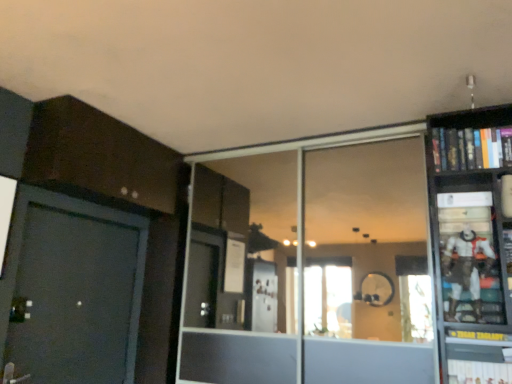
Question: From a real-world perspective, is hardcover book at lower right, the 2th book when ordered from top to bottom, located higher than white matte action figure at right?

Choices:
 (A) no
 (B) yes

Answer: (A)

Question: From the image's perspective, is hardcover book at lower right, positioned as the 1th book in bottom-to-top order, located above white matte action figure at right?

Choices:
 (A) yes
 (B) no

Answer: (B)

Question: From the image's perspective, would you say hardcover book at lower right, the 2th book when ordered from top to bottom, is shown under white matte action figure at right?

Choices:
 (A) yes
 (B) no

Answer: (A)

Question: Is hardcover book at lower right, the 2th book when ordered from top to bottom, facing towards white matte action figure at right?

Choices:
 (A) yes
 (B) no

Answer: (B)

Question: From a real-world perspective, is hardcover book at lower right, the 2th book when ordered from top to bottom, below white matte action figure at right?

Choices:
 (A) yes
 (B) no

Answer: (A)

Question: Is hardcover book at lower right, the 2th book when ordered from top to bottom, to the left or to the right of hardcover book at upper right, which is counted as the 2th book, starting from the bottom, in the image?

Choices:
 (A) left
 (B) right

Answer: (A)

Question: From the image's perspective, is hardcover book at lower right, the 2th book when ordered from top to bottom, located above or below hardcover book at upper right, which is the 1th book in top-to-bottom order?

Choices:
 (A) below
 (B) above

Answer: (A)

Question: Looking at their shapes, would you say hardcover book at lower right, positioned as the 1th book in bottom-to-top order, is wider or thinner than hardcover book at upper right, which is counted as the 2th book, starting from the bottom?

Choices:
 (A) thin
 (B) wide

Answer: (B)

Question: Considering the positions of point (448, 367) and point (463, 152), is point (448, 367) closer or farther from the camera than point (463, 152)?

Choices:
 (A) closer
 (B) farther

Answer: (A)

Question: Do you think transparent glass door at center is within white matte action figure at right, or outside of it?

Choices:
 (A) inside
 (B) outside

Answer: (B)

Question: Considering the positions of point pyautogui.click(x=198, y=291) and point pyautogui.click(x=450, y=243), is point pyautogui.click(x=198, y=291) closer or farther from the camera than point pyautogui.click(x=450, y=243)?

Choices:
 (A) farther
 (B) closer

Answer: (A)

Question: From the image's perspective, is transparent glass door at center located above or below white matte action figure at right?

Choices:
 (A) below
 (B) above

Answer: (A)

Question: From a real-world perspective, is transparent glass door at center positioned above or below white matte action figure at right?

Choices:
 (A) below
 (B) above

Answer: (B)

Question: Is white matte action figure at right to the left or to the right of hardcover book at upper right, which is the 1th book in top-to-bottom order, in the image?

Choices:
 (A) left
 (B) right

Answer: (A)

Question: In the image, is white matte action figure at right positioned in front of or behind hardcover book at upper right, which is the 1th book in top-to-bottom order?

Choices:
 (A) behind
 (B) front

Answer: (B)